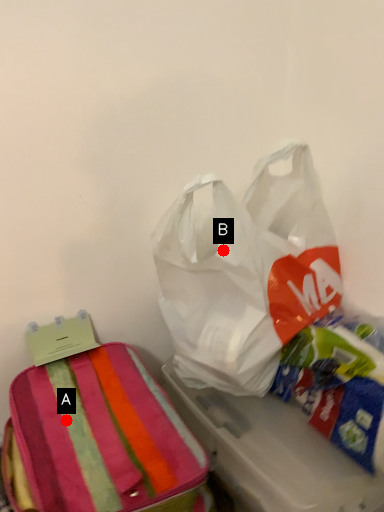
Question: Two points are circled on the image, labeled by A and B beside each circle. Which of the following is the closest to the observer?

Choices:
 (A) A is closer
 (B) B is closer

Answer: (B)